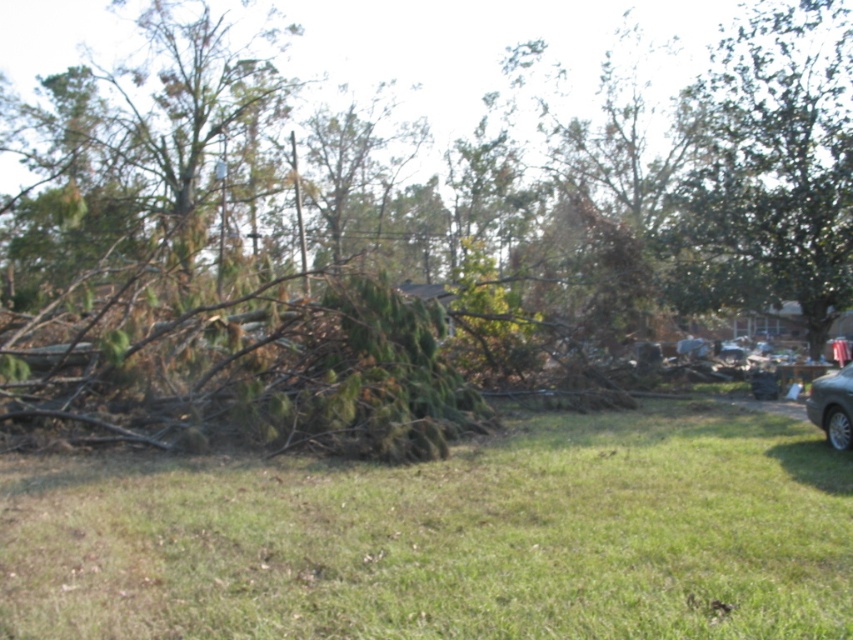
Which is below, brown wood debris at center or silver metallic car at lower right?

brown wood debris at center is lower down.

Does brown wood debris at center appear under silver metallic car at lower right?

Yes, brown wood debris at center is below silver metallic car at lower right.

Find the location of a particular element. brown wood debris at center is located at coordinates tap(445, 538).

In the scene shown: Who is positioned more to the right, brown wood debris at center or green leafy tree at upper right?

green leafy tree at upper right is more to the right.

What do you see at coordinates (445, 538) in the screenshot?
I see `brown wood debris at center` at bounding box center [445, 538].

You are a GUI agent. You are given a task and a screenshot of the screen. Output one action in this format:
    pyautogui.click(x=<x>, y=<y>)
    Task: Click on the brown wood debris at center
    
    Given the screenshot: What is the action you would take?
    (x=445, y=538)

Measure the distance from green leafy tree at upper right to silver metallic car at lower right.

green leafy tree at upper right and silver metallic car at lower right are 19.50 meters apart from each other.

Is green leafy tree at upper right positioned in front of silver metallic car at lower right?

No, it is not.

Who is more forward, [834,292] or [848,408]?

Point [848,408] is more forward.

Identify the location of green leafy tree at upper right. (772, 172).